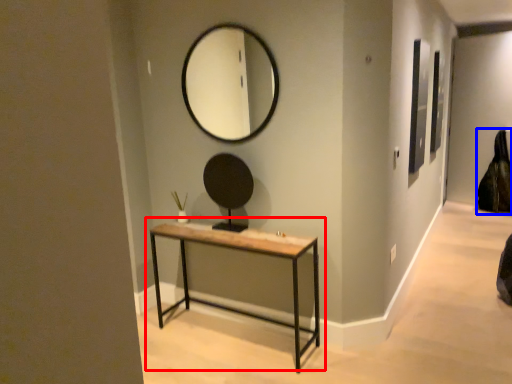
Question: Which of the following is the farthest to the observer, table (highlighted by a red box) or swivel chair (highlighted by a blue box)?

Choices:
 (A) table
 (B) swivel chair

Answer: (B)